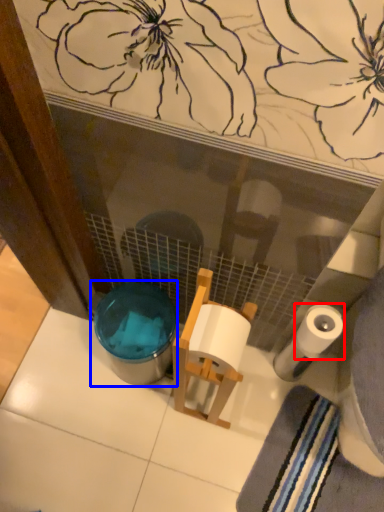
Question: Which of the following is the closest to the observer, toilet paper (highlighted by a red box) or potty (highlighted by a blue box)?

Choices:
 (A) toilet paper
 (B) potty

Answer: (A)